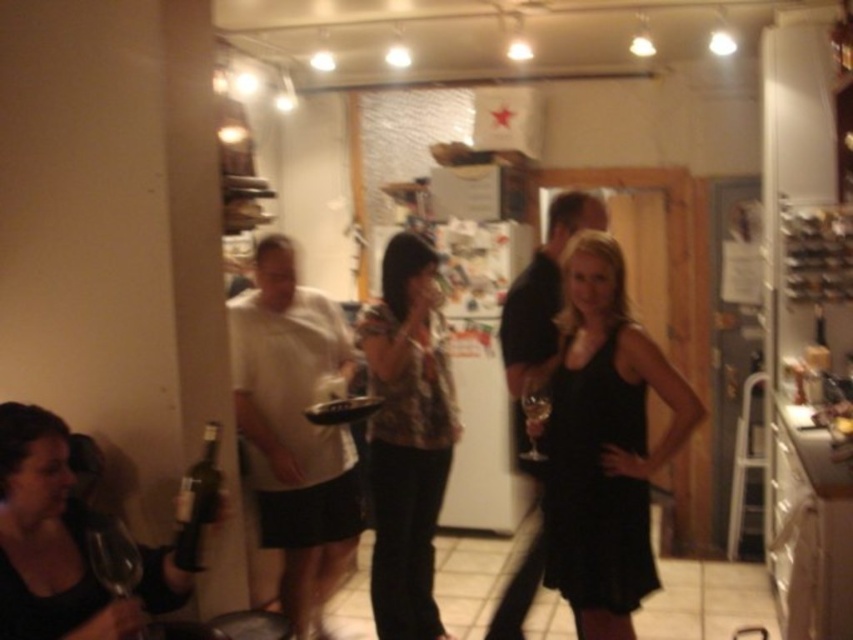
You are at a party and want to find the black satin dress at center. According to the coordinates provided, where should you look in the image?

The black satin dress at center is located at point coordinates of [604,442].

From the picture: You are a photographer at the event and want to capture both the camouflage fabric shirt at center and the transparent glass wine glass at lower left in the same frame. Which object should you focus on first to ensure both are in focus?

The camouflage fabric shirt at center should be focused on first because it has a larger size compared to the transparent glass wine glass at lower left, making it easier to ensure both are in focus when starting with the larger object.